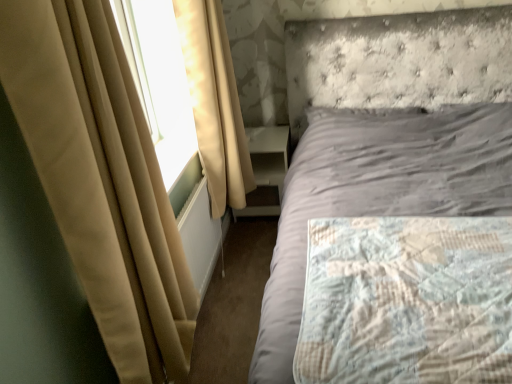
Question: Is white glossy nightstand at center at the right side of beige fabric curtain at left, which is the 2th curtain from back to front?

Choices:
 (A) no
 (B) yes

Answer: (B)

Question: Considering the relative sizes of white glossy nightstand at center and beige fabric curtain at left, which is the 2th curtain from back to front, in the image provided, is white glossy nightstand at center thinner than beige fabric curtain at left, which is the 2th curtain from back to front,?

Choices:
 (A) no
 (B) yes

Answer: (A)

Question: Does white glossy nightstand at center turn towards beige fabric curtain at left, which is the 2th curtain from back to front?

Choices:
 (A) no
 (B) yes

Answer: (B)

Question: Considering the relative positions of white glossy nightstand at center and beige fabric curtain at left, placed as the first curtain when sorted from front to back, in the image provided, is white glossy nightstand at center in front of beige fabric curtain at left, placed as the first curtain when sorted from front to back,?

Choices:
 (A) no
 (B) yes

Answer: (A)

Question: From the image's perspective, is white glossy nightstand at center above beige fabric curtain at left, which is the 2th curtain from back to front?

Choices:
 (A) yes
 (B) no

Answer: (A)

Question: Is white glossy nightstand at center completely or partially outside of beige fabric curtain at left, which is the 2th curtain from back to front?

Choices:
 (A) yes
 (B) no

Answer: (A)

Question: Is beige fabric curtain at left, the second curtain from the front, thinner than quilted fabric mattress at right?

Choices:
 (A) no
 (B) yes

Answer: (B)

Question: Is beige fabric curtain at left, the second curtain from the front, placed right next to quilted fabric mattress at right?

Choices:
 (A) no
 (B) yes

Answer: (A)

Question: From a real-world perspective, is beige fabric curtain at left, which is the 1th curtain from back to front, located beneath quilted fabric mattress at right?

Choices:
 (A) no
 (B) yes

Answer: (A)

Question: Does beige fabric curtain at left, which is the 1th curtain from back to front, contain quilted fabric mattress at right?

Choices:
 (A) no
 (B) yes

Answer: (A)

Question: From the image's perspective, is beige fabric curtain at left, which is the 1th curtain from back to front, above quilted fabric mattress at right?

Choices:
 (A) no
 (B) yes

Answer: (B)

Question: Can you confirm if beige fabric curtain at left, the second curtain from the front, is bigger than quilted fabric mattress at right?

Choices:
 (A) no
 (B) yes

Answer: (B)

Question: Could you tell me if beige fabric curtain at left, placed as the first curtain when sorted from front to back, is facing quilted fabric mattress at right?

Choices:
 (A) no
 (B) yes

Answer: (B)